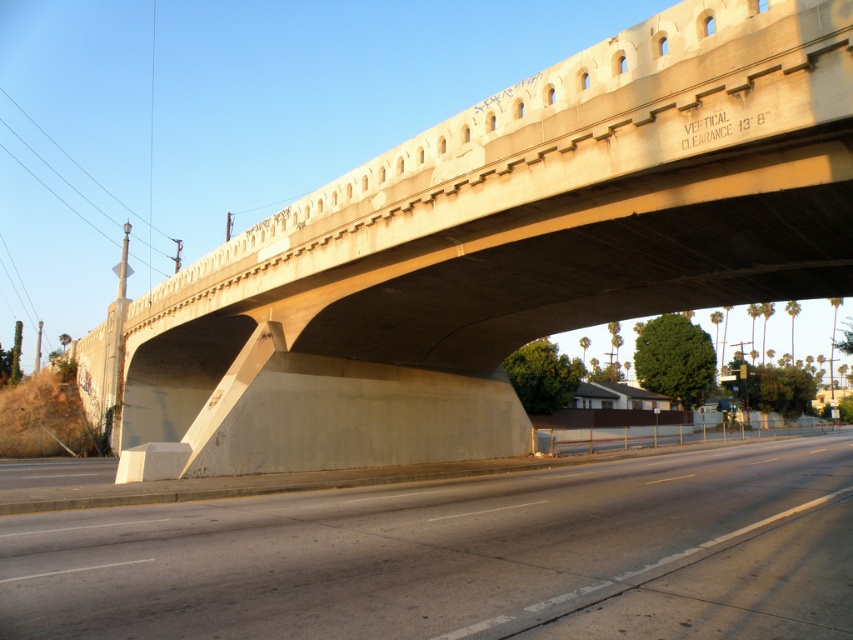
You are driving a truck that is 13 feet 6 inches tall and need to pass under the bridge. The bridge has a vertical clearance of 13 feet 8 inches. There are two points marked on the bridge structure. One is at coordinates point (787, 136) and the other at point (759, 621). Which point should you aim for to ensure your truck safely clears the height restriction?

You should aim for point (787, 136) because it is behind point (759, 621), meaning it is closer to the end of the bridge where the clearance might be consistent. Since the vertical clearance is 13 feet 8 inches and your truck is 13 feet 6 inches tall, there is enough space to safely pass under the bridge.

You are driving a truck that is 13 feet tall. You approach the bridge and see the concrete bridge at center and the gray concrete highway at lower center. Which object is positioned to the left of the other?

The concrete bridge at center is to the left of the gray concrete highway at lower center, so the concrete bridge at center is positioned to the left of the gray concrete highway at lower center.